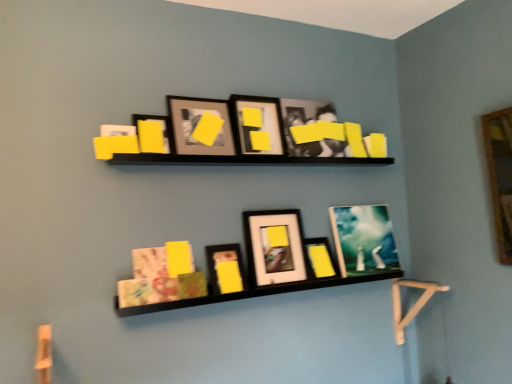
Question: Which direction should I rotate to look at matte black picture frame at center, acting as the 5th picture frame starting from the left, — up or down?

Choices:
 (A) down
 (B) up

Answer: (A)

Question: Is matte black picture frame at upper center, acting as the eighth picture frame starting from the right, positioned with its back to matte paper book at lower center?

Choices:
 (A) no
 (B) yes

Answer: (A)

Question: Does matte black picture frame at upper center, the first picture frame when ordered from left to right, have a smaller size compared to matte paper book at lower center?

Choices:
 (A) yes
 (B) no

Answer: (A)

Question: From a real-world perspective, is matte black picture frame at upper center, acting as the eighth picture frame starting from the right, physically below matte paper book at lower center?

Choices:
 (A) yes
 (B) no

Answer: (B)

Question: Considering the relative sizes of matte black picture frame at upper center, the first picture frame when ordered from left to right, and matte paper book at lower center in the image provided, is matte black picture frame at upper center, the first picture frame when ordered from left to right, taller than matte paper book at lower center?

Choices:
 (A) yes
 (B) no

Answer: (B)

Question: Is matte black picture frame at upper center, acting as the eighth picture frame starting from the right, closer to camera compared to matte paper book at lower center?

Choices:
 (A) no
 (B) yes

Answer: (A)

Question: Does matte black picture frame at upper center, acting as the eighth picture frame starting from the right, have a lesser width compared to matte paper book at lower center?

Choices:
 (A) no
 (B) yes

Answer: (B)

Question: Considering the relative positions of matte black picture frame at center, the third picture frame in the left-to-right sequence, and matte black picture frame at upper center, acting as the eighth picture frame starting from the right, in the image provided, is matte black picture frame at center, the third picture frame in the left-to-right sequence, to the left of matte black picture frame at upper center, acting as the eighth picture frame starting from the right, from the viewer's perspective?

Choices:
 (A) no
 (B) yes

Answer: (A)

Question: Is matte black picture frame at center, the third picture frame in the left-to-right sequence, positioned behind matte black picture frame at upper center, acting as the eighth picture frame starting from the right?

Choices:
 (A) no
 (B) yes

Answer: (B)

Question: Are matte black picture frame at center, which is the 6th picture frame from right to left, and matte black picture frame at upper center, the first picture frame when ordered from left to right, located far from each other?

Choices:
 (A) yes
 (B) no

Answer: (B)

Question: Is matte black picture frame at center, which is the 6th picture frame from right to left, facing away from matte black picture frame at upper center, acting as the eighth picture frame starting from the right?

Choices:
 (A) yes
 (B) no

Answer: (B)

Question: Can you confirm if matte black picture frame at center, the third picture frame in the left-to-right sequence, is shorter than matte black picture frame at upper center, acting as the eighth picture frame starting from the right?

Choices:
 (A) yes
 (B) no

Answer: (B)

Question: From a real-world perspective, is matte black picture frame at center, the third picture frame in the left-to-right sequence, physically above matte black picture frame at upper center, acting as the eighth picture frame starting from the right?

Choices:
 (A) no
 (B) yes

Answer: (A)

Question: Would you say matte black picture frame at upper center, which is the seventh picture frame from right to left, is outside matte glass picture frame at upper center, acting as the 8th picture frame starting from the left?

Choices:
 (A) no
 (B) yes

Answer: (B)